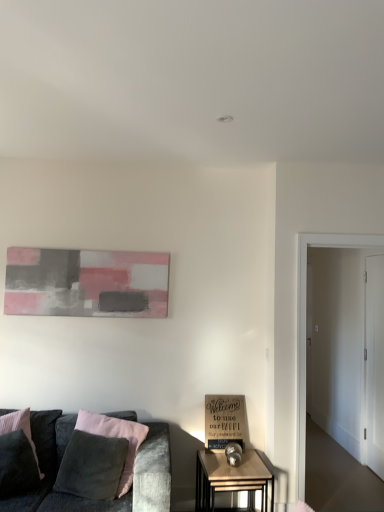
Question: Based on their sizes in the image, would you say velvet grey couch at lower left is bigger or smaller than abstract painting at upper left?

Choices:
 (A) big
 (B) small

Answer: (A)

Question: From the image's perspective, relative to abstract painting at upper left, is velvet grey couch at lower left above or below?

Choices:
 (A) below
 (B) above

Answer: (A)

Question: Based on their relative distances, which object is nearer to the white glossy door at right, the second glass door viewed from the front?

Choices:
 (A) white glossy door at right, placed as the 2th glass door when sorted from right to left
 (B) dark gray fabric pillow at lower left
 (C) velvet grey couch at lower left
 (D) wooden side table at lower center
 (E) abstract painting at upper left

Answer: (A)

Question: Which object is the farthest from the velvet grey couch at lower left?

Choices:
 (A) wooden signboard at lower center
 (B) wooden side table at lower center
 (C) dark gray fabric pillow at lower left
 (D) white glossy door at right, the second glass door viewed from the front
 (E) white glossy door at right, which ranks as the first glass door in front-to-back order

Answer: (D)